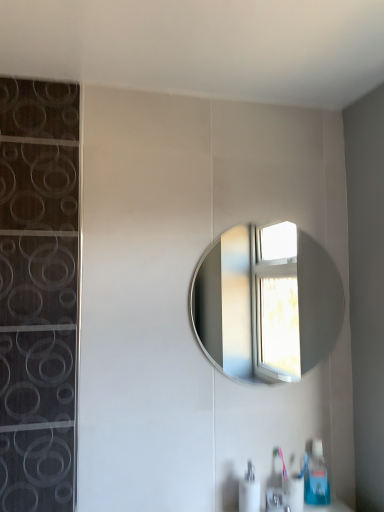
Question: From the image's perspective, is satin nickel faucet at lower center below white glossy soap dispenser at lower center, which appears as the second soap dispenser when viewed from the right?

Choices:
 (A) yes
 (B) no

Answer: (A)

Question: Considering the relative sizes of satin nickel faucet at lower center and white glossy soap dispenser at lower center, which appears as the second soap dispenser when viewed from the right, in the image provided, is satin nickel faucet at lower center smaller than white glossy soap dispenser at lower center, which appears as the second soap dispenser when viewed from the right,?

Choices:
 (A) yes
 (B) no

Answer: (A)

Question: From a real-world perspective, is satin nickel faucet at lower center positioned over white glossy soap dispenser at lower center, which is the first soap dispenser in left-to-right order, based on gravity?

Choices:
 (A) yes
 (B) no

Answer: (B)

Question: Is satin nickel faucet at lower center positioned far away from white glossy soap dispenser at lower center, the 2th soap dispenser when ordered from back to front?

Choices:
 (A) yes
 (B) no

Answer: (B)

Question: Is satin nickel faucet at lower center not within white glossy soap dispenser at lower center, arranged as the 1th soap dispenser when viewed from the front?

Choices:
 (A) yes
 (B) no

Answer: (A)

Question: From their relative heights in the image, would you say silver metallic mirror at center is taller or shorter than blue plastic soap dispenser at lower right, the 2th soap dispenser when ordered from front to back?

Choices:
 (A) tall
 (B) short

Answer: (A)

Question: Considering the positions of point (216, 320) and point (319, 473), is point (216, 320) closer or farther from the camera than point (319, 473)?

Choices:
 (A) closer
 (B) farther

Answer: (B)

Question: From the image's perspective, relative to blue plastic soap dispenser at lower right, which is the first soap dispenser from back to front, is silver metallic mirror at center above or below?

Choices:
 (A) below
 (B) above

Answer: (B)

Question: From a real-world perspective, is silver metallic mirror at center above or below blue plastic soap dispenser at lower right, the 1th soap dispenser when ordered from right to left?

Choices:
 (A) below
 (B) above

Answer: (B)

Question: Relative to satin nickel faucet at lower center, is silver metallic mirror at center in front or behind?

Choices:
 (A) behind
 (B) front

Answer: (A)

Question: From a real-world perspective, is silver metallic mirror at center above or below satin nickel faucet at lower center?

Choices:
 (A) above
 (B) below

Answer: (A)

Question: Is silver metallic mirror at center to the left or to the right of satin nickel faucet at lower center in the image?

Choices:
 (A) left
 (B) right

Answer: (A)

Question: From the image's perspective, relative to satin nickel faucet at lower center, is silver metallic mirror at center above or below?

Choices:
 (A) below
 (B) above

Answer: (B)

Question: From a real-world perspective, is satin nickel faucet at lower center physically located above or below silver metallic mirror at center?

Choices:
 (A) below
 (B) above

Answer: (A)

Question: From the image's perspective, is satin nickel faucet at lower center located above or below silver metallic mirror at center?

Choices:
 (A) above
 (B) below

Answer: (B)